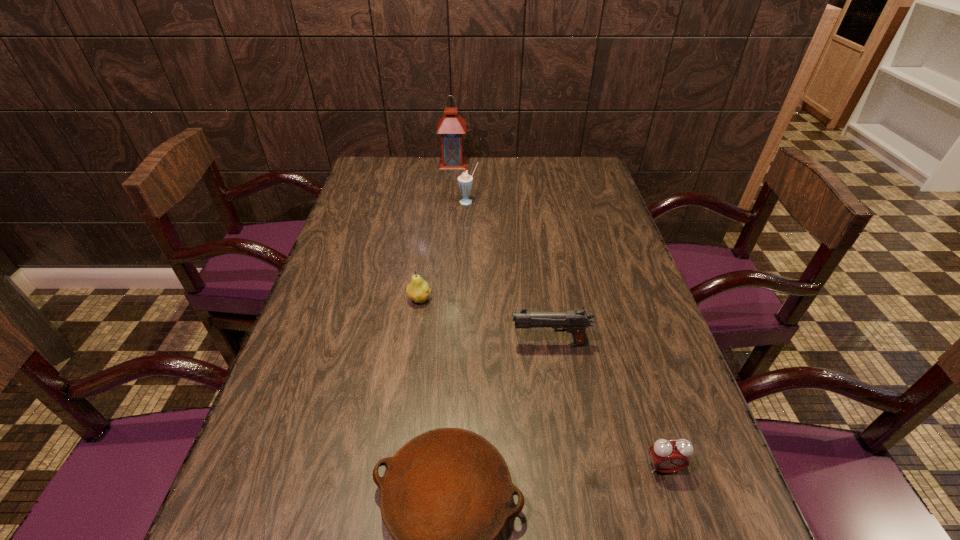
The width and height of the screenshot is (960, 540). Find the location of `lantern`. lantern is located at coordinates point(451,126).

At what (x,y) coordinates should I click in order to perform the action: click on the tallest object. Please return your answer as a coordinate pair (x, y). The width and height of the screenshot is (960, 540). Looking at the image, I should click on (451, 126).

You are a GUI agent. You are given a task and a screenshot of the screen. Output one action in this format:
    pyautogui.click(x=<x>, y=<y>)
    Task: Click on the milkshake
    
    Given the screenshot: What is the action you would take?
    pyautogui.click(x=465, y=181)

Find the location of `the fifth nearest object`. the fifth nearest object is located at coordinates (465, 181).

The width and height of the screenshot is (960, 540). Find the location of `the third nearest object`. the third nearest object is located at coordinates (575, 321).

What are the coordinates of `the fourth shortest object` in the screenshot? It's located at (575, 321).

You are a GUI agent. You are given a task and a screenshot of the screen. Output one action in this format:
    pyautogui.click(x=<x>, y=<y>)
    Task: Click on the fourth nearest object
    This screenshot has height=540, width=960.
    Given the screenshot: What is the action you would take?
    pyautogui.click(x=417, y=290)

Find the location of `alarm clock`. alarm clock is located at coordinates (x=668, y=456).

At what (x,y) coordinates should I click in order to perform the action: click on free space located on the left of the tallest object. Please return your answer as a coordinate pair (x, y). Looking at the image, I should click on pos(396,163).

Where is `free space located 0.230m on the straw side of the milkshake`? The width and height of the screenshot is (960, 540). free space located 0.230m on the straw side of the milkshake is located at coordinates (467, 250).